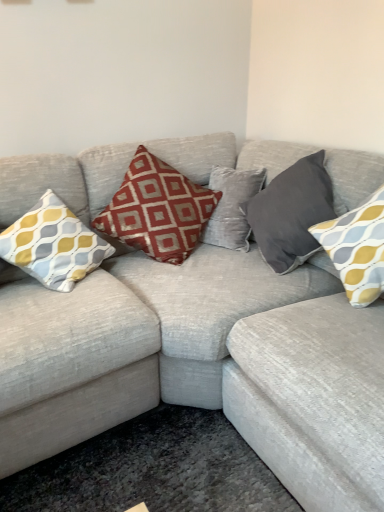
What do you see at coordinates (202, 365) in the screenshot? I see `textured gray couch at center` at bounding box center [202, 365].

What do you see at coordinates (357, 248) in the screenshot? I see `yellow-grey patterned pillow at right, placed as the 1th pillow when sorted from right to left` at bounding box center [357, 248].

Locate an element on the screen. This screenshot has height=512, width=384. textured gray couch at center is located at coordinates (202, 365).

From a real-world perspective, is textured gray couch at center physically above red printed cushion at center, which is the 2th pillow from left to right?

No, from a real-world perspective, textured gray couch at center is not on top of red printed cushion at center, which is the 2th pillow from left to right.

Consider the image. Considering the positions of objects textured gray couch at center and red printed cushion at center, which is the 2th pillow from left to right, in the image provided, who is more to the right, textured gray couch at center or red printed cushion at center, which is the 2th pillow from left to right,?

Positioned to the right is textured gray couch at center.

Considering their positions, is textured gray couch at center located in front of or behind red printed cushion at center, the 3th pillow from the right?

Clearly, textured gray couch at center is in front of red printed cushion at center, the 3th pillow from the right.

Does textured gray couch at center touch red printed cushion at center, which is the 2th pillow from left to right?

textured gray couch at center and red printed cushion at center, which is the 2th pillow from left to right, are not in contact.

The image size is (384, 512). I want to click on the 1st pillow behind when counting from the textured gray couch at center, so click(357, 248).

Does yellow-grey patterned pillow at right, placed as the 1th pillow when sorted from right to left, lie behind textured gray couch at center?

Yes, yellow-grey patterned pillow at right, placed as the 1th pillow when sorted from right to left, is further from the camera.

Considering the sizes of yellow-grey patterned pillow at right, placed as the 1th pillow when sorted from right to left, and textured gray couch at center in the image, is yellow-grey patterned pillow at right, placed as the 1th pillow when sorted from right to left, bigger or smaller than textured gray couch at center?

In the image, yellow-grey patterned pillow at right, placed as the 1th pillow when sorted from right to left, appears to be smaller than textured gray couch at center.

From a real-world perspective, is yellow-grey patterned pillow at right, which is the 4th pillow from left to right, below textured gray couch at center?

Incorrect, from a real-world perspective, yellow-grey patterned pillow at right, which is the 4th pillow from left to right, is higher than textured gray couch at center.

From a real-world perspective, is textured gray couch at center positioned under yellow-grey patterned cushion at left, the 4th pillow viewed from the right, based on gravity?

Yes, from a real-world perspective, textured gray couch at center is below yellow-grey patterned cushion at left, the 4th pillow viewed from the right.

Is textured gray couch at center situated inside yellow-grey patterned cushion at left, the 4th pillow viewed from the right, or outside?

textured gray couch at center is not inside yellow-grey patterned cushion at left, the 4th pillow viewed from the right, it's outside.

Could you measure the distance between textured gray couch at center and yellow-grey patterned cushion at left, the 4th pillow viewed from the right?

textured gray couch at center is 14.95 inches away from yellow-grey patterned cushion at left, the 4th pillow viewed from the right.

Is textured gray couch at center directly adjacent to yellow-grey patterned cushion at left, which ranks as the first pillow in left-to-right order?

No.

Who is taller, red printed cushion at center, the 3th pillow from the right, or yellow-grey patterned pillow at right, which is the 4th pillow from left to right?

red printed cushion at center, the 3th pillow from the right, is taller.

Who is bigger, red printed cushion at center, the 3th pillow from the right, or yellow-grey patterned pillow at right, which is the 4th pillow from left to right?

red printed cushion at center, the 3th pillow from the right, is bigger.

Which is behind, red printed cushion at center, the 3th pillow from the right, or yellow-grey patterned pillow at right, placed as the 1th pillow when sorted from right to left?

Positioned behind is red printed cushion at center, the 3th pillow from the right.

From the picture: Does red printed cushion at center, the 3th pillow from the right, turn towards yellow-grey patterned pillow at right, placed as the 1th pillow when sorted from right to left?

Yes, red printed cushion at center, the 3th pillow from the right, is facing yellow-grey patterned pillow at right, placed as the 1th pillow when sorted from right to left.

Is point (364, 260) behind point (70, 216)?

No, it is not.

From a real-world perspective, between yellow-grey patterned pillow at right, which is the 4th pillow from left to right, and yellow-grey patterned cushion at left, which ranks as the first pillow in left-to-right order, who is vertically lower?

yellow-grey patterned cushion at left, which ranks as the first pillow in left-to-right order.

Is yellow-grey patterned pillow at right, which is the 4th pillow from left to right, completely or partially outside of yellow-grey patterned cushion at left, the 4th pillow viewed from the right?

Indeed, yellow-grey patterned pillow at right, which is the 4th pillow from left to right, is completely outside yellow-grey patterned cushion at left, the 4th pillow viewed from the right.

Is yellow-grey patterned pillow at right, which is the 4th pillow from left to right, bigger than yellow-grey patterned cushion at left, which ranks as the first pillow in left-to-right order?

Actually, yellow-grey patterned pillow at right, which is the 4th pillow from left to right, might be smaller than yellow-grey patterned cushion at left, which ranks as the first pillow in left-to-right order.

Is red printed cushion at center, which is the 2th pillow from left to right, surrounded by yellow-grey patterned cushion at left, the 4th pillow viewed from the right?

That's incorrect, red printed cushion at center, which is the 2th pillow from left to right, is not inside yellow-grey patterned cushion at left, the 4th pillow viewed from the right.

In the image, is yellow-grey patterned cushion at left, the 4th pillow viewed from the right, positioned in front of or behind red printed cushion at center, which is the 2th pillow from left to right?

Visually, yellow-grey patterned cushion at left, the 4th pillow viewed from the right, is located in front of red printed cushion at center, which is the 2th pillow from left to right.

Could you tell me if yellow-grey patterned cushion at left, which ranks as the first pillow in left-to-right order, is facing red printed cushion at center, which is the 2th pillow from left to right?

No, yellow-grey patterned cushion at left, which ranks as the first pillow in left-to-right order, is not facing towards red printed cushion at center, which is the 2th pillow from left to right.

From a real-world perspective, is red printed cushion at center, the 3th pillow from the right, above or below yellow-grey patterned cushion at left, which ranks as the first pillow in left-to-right order?

From a real-world perspective, red printed cushion at center, the 3th pillow from the right, is physically below yellow-grey patterned cushion at left, which ranks as the first pillow in left-to-right order.

Locate an element on the screen. the 2nd pillow behind the yellow-grey patterned cushion at left, which ranks as the first pillow in left-to-right order, counting from the anchor's position is located at coordinates (157, 210).

Is yellow-grey patterned cushion at left, which ranks as the first pillow in left-to-right order, at the back of red printed cushion at center, which is the 2th pillow from left to right?

That's not correct — red printed cushion at center, which is the 2th pillow from left to right, is not looking away from yellow-grey patterned cushion at left, which ranks as the first pillow in left-to-right order.

Is red printed cushion at center, which is the 2th pillow from left to right, placed right next to yellow-grey patterned cushion at left, the 4th pillow viewed from the right?

No.

I want to click on studio couch located below the red printed cushion at center, the 3th pillow from the right (from the image's perspective), so click(202, 365).

Where is `studio couch below the yellow-grey patterned pillow at right, placed as the 1th pillow when sorted from right to left (from a real-world perspective)`? The width and height of the screenshot is (384, 512). studio couch below the yellow-grey patterned pillow at right, placed as the 1th pillow when sorted from right to left (from a real-world perspective) is located at coordinates (202, 365).

Based on their spatial positions, is yellow-grey patterned cushion at left, which ranks as the first pillow in left-to-right order, or red printed cushion at center, the 3th pillow from the right, further from textured gray couch at center?

Among the two, red printed cushion at center, the 3th pillow from the right, is located further to textured gray couch at center.

Looking at the image, which one is located closer to yellow-grey patterned pillow at right, which is the 4th pillow from left to right, dark gray velvet pillow at upper right, which is the third pillow in left-to-right order, or yellow-grey patterned cushion at left, the 4th pillow viewed from the right?

dark gray velvet pillow at upper right, which is the third pillow in left-to-right order, is positioned closer to the anchor yellow-grey patterned pillow at right, which is the 4th pillow from left to right.

Based on the photo, when comparing their distances from yellow-grey patterned cushion at left, which ranks as the first pillow in left-to-right order, does textured gray couch at center or dark gray velvet pillow at upper right, which appears as the second pillow when viewed from the right, seem further?

Based on the image, dark gray velvet pillow at upper right, which appears as the second pillow when viewed from the right, appears to be further to yellow-grey patterned cushion at left, which ranks as the first pillow in left-to-right order.

Which object lies nearer to the anchor point yellow-grey patterned cushion at left, the 4th pillow viewed from the right, yellow-grey patterned pillow at right, which is the 4th pillow from left to right, or dark gray velvet pillow at upper right, which appears as the second pillow when viewed from the right?

The object closer to yellow-grey patterned cushion at left, the 4th pillow viewed from the right, is dark gray velvet pillow at upper right, which appears as the second pillow when viewed from the right.

When comparing their distances from textured gray couch at center, does red printed cushion at center, which is the 2th pillow from left to right, or dark gray velvet pillow at upper right, which appears as the second pillow when viewed from the right, seem further?

dark gray velvet pillow at upper right, which appears as the second pillow when viewed from the right.

Based on their spatial positions, is dark gray velvet pillow at upper right, which is the third pillow in left-to-right order, or textured gray couch at center closer to red printed cushion at center, which is the 2th pillow from left to right?

dark gray velvet pillow at upper right, which is the third pillow in left-to-right order, lies closer to red printed cushion at center, which is the 2th pillow from left to right, than the other object.

In the scene shown: From the image, which object appears to be farther from yellow-grey patterned cushion at left, which ranks as the first pillow in left-to-right order, yellow-grey patterned pillow at right, placed as the 1th pillow when sorted from right to left, or red printed cushion at center, which is the 2th pillow from left to right?

yellow-grey patterned pillow at right, placed as the 1th pillow when sorted from right to left, is further to yellow-grey patterned cushion at left, which ranks as the first pillow in left-to-right order.

Which object lies nearer to the anchor point yellow-grey patterned cushion at left, the 4th pillow viewed from the right, textured gray couch at center or yellow-grey patterned pillow at right, placed as the 1th pillow when sorted from right to left?

Result: Based on the image, textured gray couch at center appears to be nearer to yellow-grey patterned cushion at left, the 4th pillow viewed from the right.

Find the location of a particular element. studio couch between yellow-grey patterned cushion at left, which ranks as the first pillow in left-to-right order, and yellow-grey patterned pillow at right, which is the 4th pillow from left to right, in the horizontal direction is located at coordinates (202, 365).

At what (x,y) coordinates should I click in order to perform the action: click on pillow located between red printed cushion at center, which is the 2th pillow from left to right, and yellow-grey patterned pillow at right, placed as the 1th pillow when sorted from right to left, in the left-right direction. Please return your answer as a coordinate pair (x, y). Looking at the image, I should click on (290, 207).

Locate an element on the screen. pillow between yellow-grey patterned cushion at left, which ranks as the first pillow in left-to-right order, and dark gray velvet pillow at upper right, which appears as the second pillow when viewed from the right, in the horizontal direction is located at coordinates (157, 210).